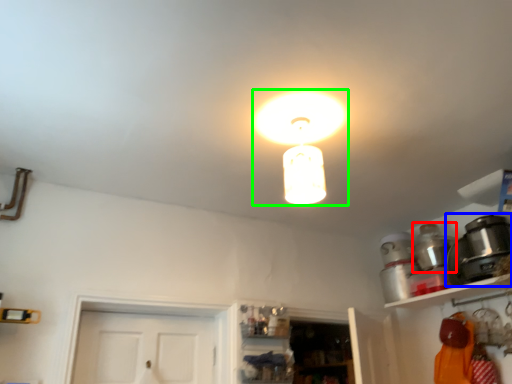
Question: Which is nearer to the appliance (highlighted by a red box)? appliance (highlighted by a blue box) or lamp (highlighted by a green box).

Choices:
 (A) appliance
 (B) lamp

Answer: (A)